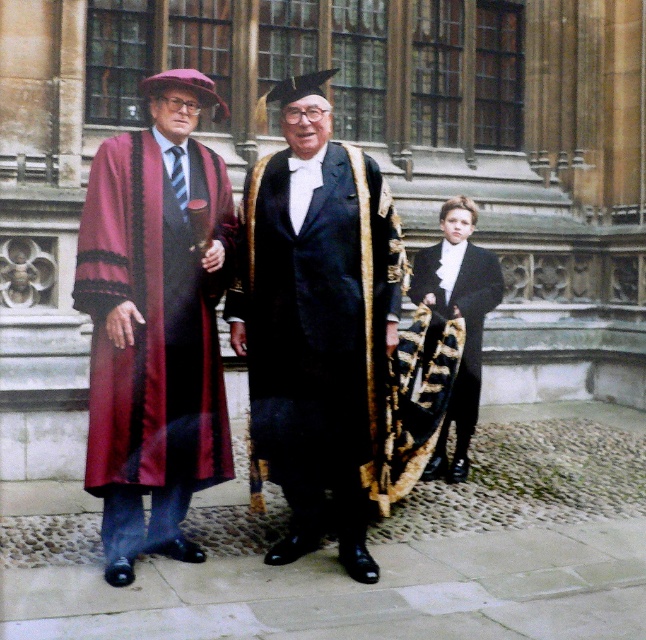
Between maroon satin robe at left and black satin tuxedo at center, which one appears on the right side from the viewer's perspective?

Positioned to the right is black satin tuxedo at center.

Find the location of a particular element. maroon satin robe at left is located at coordinates (154, 323).

Does maroon satin robe at left have a greater height compared to shiny black robe at center?

Indeed, maroon satin robe at left has a greater height compared to shiny black robe at center.

Who is lower down, maroon satin robe at left or shiny black robe at center?

Positioned lower is shiny black robe at center.

Which is behind, point (120, 465) or point (302, 221)?

The point (302, 221) is more distant.

In order to click on maroon satin robe at left in this screenshot , I will do 154,323.

Does shiny black robe at center appear on the left side of black satin tuxedo at center?

Correct, you'll find shiny black robe at center to the left of black satin tuxedo at center.

Can you confirm if shiny black robe at center is shorter than black satin tuxedo at center?

In fact, shiny black robe at center may be taller than black satin tuxedo at center.

You are a GUI agent. You are given a task and a screenshot of the screen. Output one action in this format:
    pyautogui.click(x=<x>, y=<y>)
    Task: Click on the shiny black robe at center
    This screenshot has width=646, height=640.
    Given the screenshot: What is the action you would take?
    pyautogui.click(x=317, y=321)